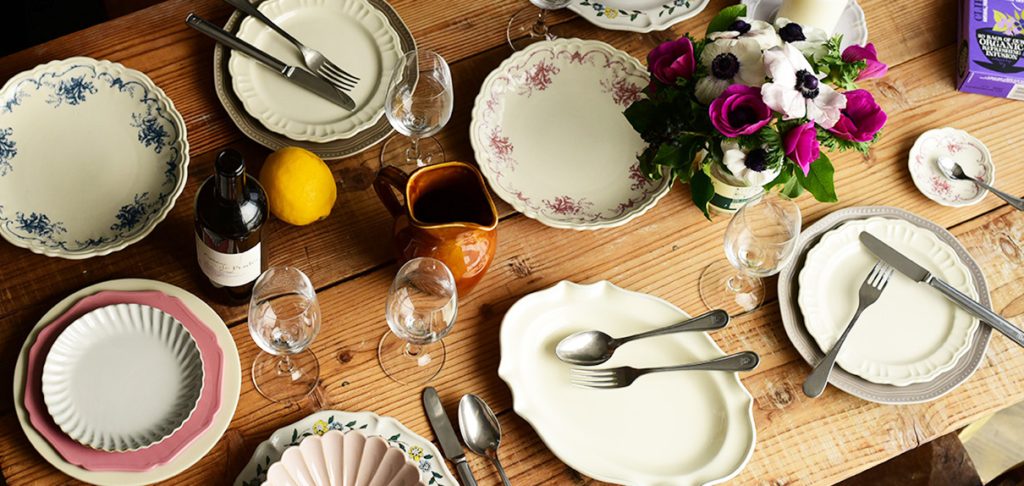
Find the location of a particular element. The height and width of the screenshot is (486, 1024). wine glasses is located at coordinates (294, 315), (412, 309), (421, 124), (761, 229), (554, 7).